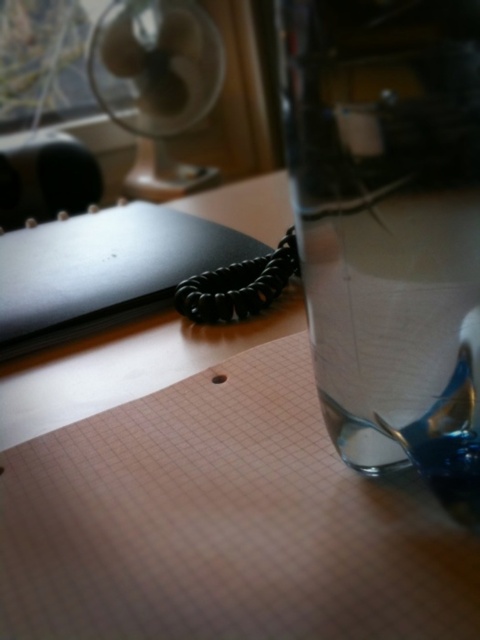
Question: Does transparent glass jar at right have a larger size compared to white plastic fan at upper left?

Choices:
 (A) no
 (B) yes

Answer: (A)

Question: Among these points, which one is farthest from the camera?

Choices:
 (A) [180, 84]
 (B) [136, 284]

Answer: (A)

Question: Is transparent glass jar at right positioned before white plastic fan at upper left?

Choices:
 (A) yes
 (B) no

Answer: (A)

Question: Can you confirm if transparent glass jar at right is thinner than white plastic fan at upper left?

Choices:
 (A) yes
 (B) no

Answer: (A)

Question: Which object appears closest to the camera in this image?

Choices:
 (A) transparent glass jar at right
 (B) matte black notepad at upper left

Answer: (A)

Question: Considering the real-world distances, which object is closest to the transparent glass jar at right?

Choices:
 (A) white plastic fan at upper left
 (B) matte black notepad at upper left

Answer: (B)